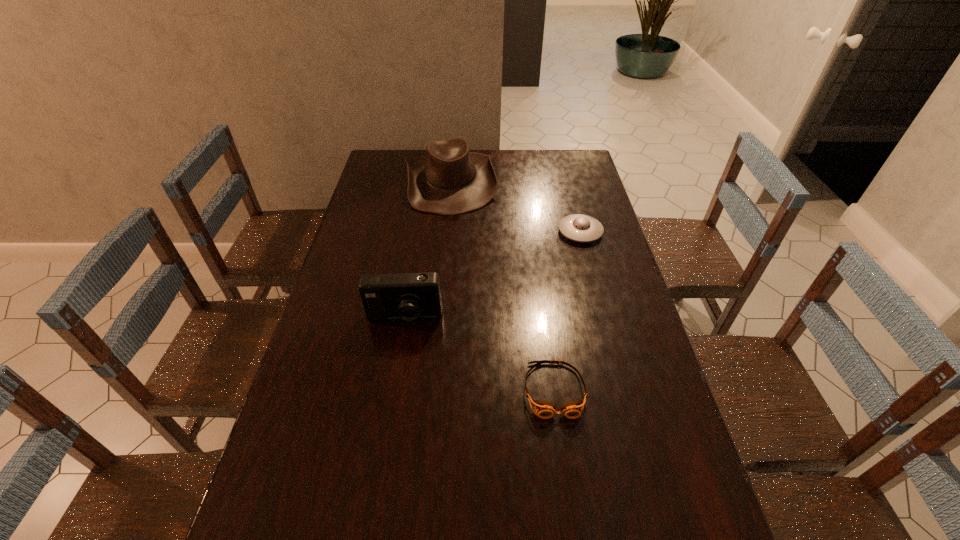
Identify the location of free space between the second object from right to left and the cowboy hat. This screenshot has width=960, height=540. (502, 286).

You are a GUI agent. You are given a task and a screenshot of the screen. Output one action in this format:
    pyautogui.click(x=<x>, y=<y>)
    Task: Click on the free point between the third farthest object and the saucer
    
    Given the screenshot: What is the action you would take?
    pyautogui.click(x=492, y=275)

Where is `free area in between the rightmost object and the cowboy hat`? free area in between the rightmost object and the cowboy hat is located at coordinates (516, 206).

Image resolution: width=960 pixels, height=540 pixels. What are the coordinates of `empty space that is in between the farthest object and the second farthest object` in the screenshot? It's located at (516, 206).

At what (x,y) coordinates should I click in order to perform the action: click on free spot between the nearest object and the rightmost object. Please return your answer as a coordinate pair (x, y). This screenshot has height=540, width=960. Looking at the image, I should click on (567, 311).

Image resolution: width=960 pixels, height=540 pixels. In order to click on free space that is in between the second farthest object and the camera in this screenshot , I will do `click(492, 275)`.

At what (x,y) coordinates should I click in order to perform the action: click on empty space between the farthest object and the second nearest object. Please return your answer as a coordinate pair (x, y). The width and height of the screenshot is (960, 540). Looking at the image, I should click on (427, 250).

Identify the location of empty space between the rightmost object and the second object from right to left. This screenshot has width=960, height=540. (567, 311).

Where is `free space between the camera and the farthest object`? Image resolution: width=960 pixels, height=540 pixels. free space between the camera and the farthest object is located at coordinates [x=427, y=250].

Select which object is the third closest to the camera. Please provide its 2D coordinates. Your answer should be formatted as a tuple, i.e. [(x, y)], where the tuple contains the x and y coordinates of a point satisfying the conditions above.

[(581, 228)]